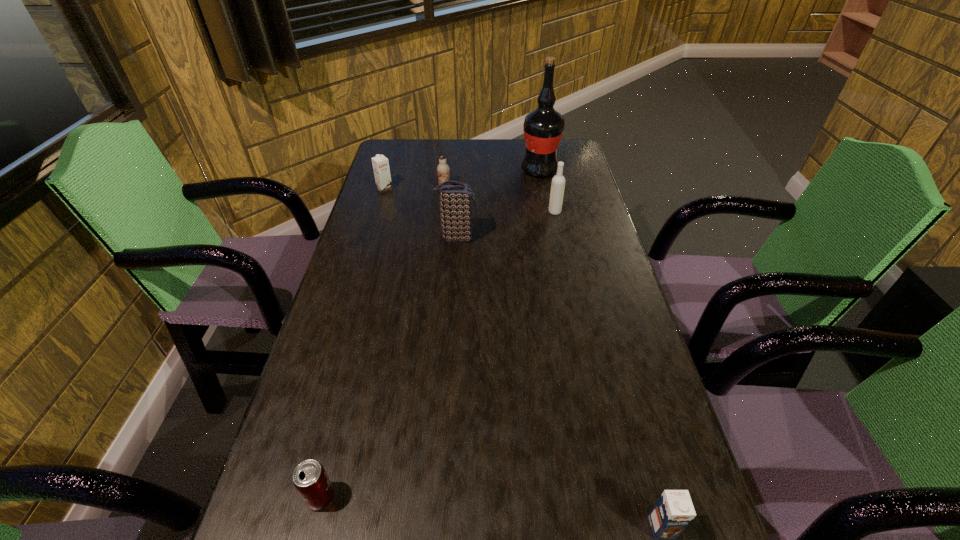
Identify the location of vacant area that lies between the beer can and the leftmost chocolate milk. This screenshot has width=960, height=540. (353, 343).

The image size is (960, 540). What are the coordinates of `vacant space in between the leftmost chocolate milk and the nearest object` in the screenshot? It's located at (523, 358).

Find the location of a particular element. free space between the beer can and the fourth nearest object is located at coordinates (438, 355).

Point out which object is positioned as the sixth nearest to the farthest object. Please provide its 2D coordinates. Your answer should be formatted as a tuple, i.e. [(x, y)], where the tuple contains the x and y coordinates of a point satisfying the conditions above.

[(310, 479)]

Select which object is the closest to the leftmost chocolate milk. Please provide its 2D coordinates. Your answer should be formatted as a tuple, i.e. [(x, y)], where the tuple contains the x and y coordinates of a point satisfying the conditions above.

[(443, 169)]

Identify the location of chocolate milk that can be found as the third closest to the beer can. (443, 169).

In order to click on chocolate milk that stands as the closest to the leftmost chocolate milk in this screenshot , I will do [443, 169].